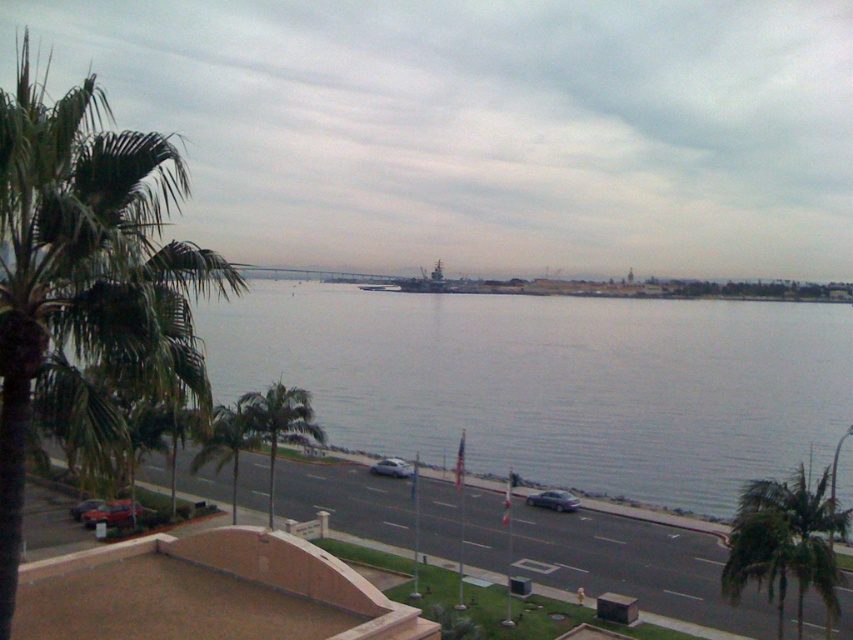
Question: Which point is farther to the camera?

Choices:
 (A) shiny silver car at lower left
 (B) satin silver sedan at lower center
 (C) gray water at center

Answer: (B)

Question: Does green leafy palm tree at left appear under green leafy palm tree at lower center?

Choices:
 (A) no
 (B) yes

Answer: (A)

Question: Can you confirm if green leafy palm tree at center is positioned above satin silver sedan at center?

Choices:
 (A) yes
 (B) no

Answer: (A)

Question: Is green leafy palm tree at lower center to the left of shiny silver car at lower left from the viewer's perspective?

Choices:
 (A) no
 (B) yes

Answer: (A)

Question: Which object is positioned farthest from the green leafy palm tree at lower right?

Choices:
 (A) gray water at center
 (B) metallic silver car at lower left
 (C) green leafy palm tree at lower center

Answer: (A)

Question: Which point appears farthest from the camera in this image?

Choices:
 (A) (86, 506)
 (B) (740, 572)
 (C) (289, 394)
 (D) (494, 356)

Answer: (D)